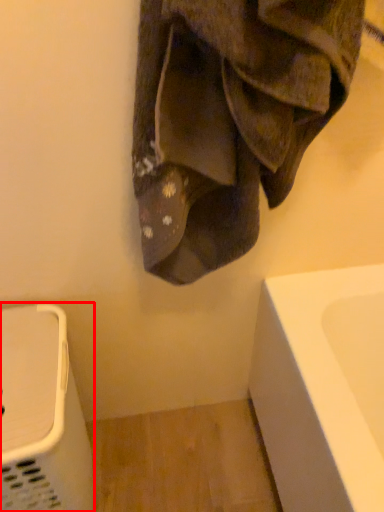
Question: Observing the image, what is the correct spatial positioning of appliance (annotated by the red box) in reference to towel?

Choices:
 (A) right
 (B) left

Answer: (B)